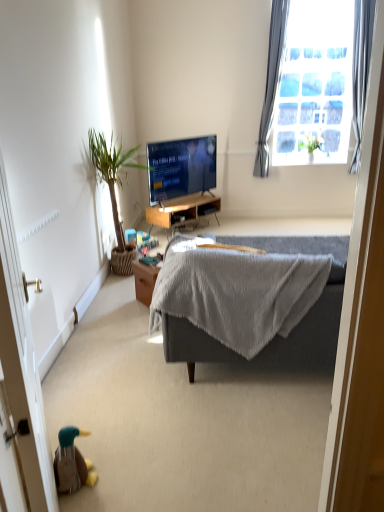
Question: Is satin gray curtain at upper right, which ranks as the first curtain in left-to-right order, closer to the viewer compared to gray fabric curtain at upper right, the 2th curtain from the left?

Choices:
 (A) yes
 (B) no

Answer: (B)

Question: Considering the relative sizes of satin gray curtain at upper right, which ranks as the first curtain in left-to-right order, and gray fabric curtain at upper right, the first curtain when ordered from right to left, in the image provided, is satin gray curtain at upper right, which ranks as the first curtain in left-to-right order, shorter than gray fabric curtain at upper right, the first curtain when ordered from right to left,?

Choices:
 (A) yes
 (B) no

Answer: (B)

Question: Does satin gray curtain at upper right, which ranks as the first curtain in left-to-right order, contain gray fabric curtain at upper right, the first curtain when ordered from right to left?

Choices:
 (A) no
 (B) yes

Answer: (A)

Question: Is the depth of satin gray curtain at upper right, which ranks as the first curtain in left-to-right order, greater than that of gray fabric curtain at upper right, the 2th curtain from the left?

Choices:
 (A) yes
 (B) no

Answer: (A)

Question: Could you tell me if satin gray curtain at upper right, the 2th curtain when ordered from right to left, is facing gray fabric curtain at upper right, the first curtain when ordered from right to left?

Choices:
 (A) no
 (B) yes

Answer: (A)

Question: Does satin gray curtain at upper right, the 2th curtain when ordered from right to left, have a smaller size compared to gray fabric curtain at upper right, the first curtain when ordered from right to left?

Choices:
 (A) no
 (B) yes

Answer: (A)

Question: From a real-world perspective, is green leafy plant at upper right, positioned as the 2th houseplant in left-to-right order, physically above gray fabric curtain at upper right, the first curtain when ordered from right to left?

Choices:
 (A) no
 (B) yes

Answer: (A)

Question: Is green leafy plant at upper right, which is the second houseplant from front to back, wider than gray fabric curtain at upper right, the first curtain when ordered from right to left?

Choices:
 (A) no
 (B) yes

Answer: (B)

Question: Is green leafy plant at upper right, the first houseplant viewed from the back, closer to the viewer compared to gray fabric curtain at upper right, the first curtain when ordered from right to left?

Choices:
 (A) yes
 (B) no

Answer: (B)

Question: Is green leafy plant at upper right, acting as the first houseplant starting from the right, looking in the opposite direction of gray fabric curtain at upper right, the 2th curtain from the left?

Choices:
 (A) yes
 (B) no

Answer: (B)

Question: Can gray fabric curtain at upper right, the 2th curtain from the left, be found inside green leafy plant at upper right, positioned as the 1th houseplant in top-to-bottom order?

Choices:
 (A) no
 (B) yes

Answer: (A)

Question: Is green leafy plant at upper right, positioned as the 1th houseplant in top-to-bottom order, completely or partially outside of gray fabric curtain at upper right, the first curtain when ordered from right to left?

Choices:
 (A) yes
 (B) no

Answer: (A)

Question: Is wooden desk at center further to camera compared to green leafy plant at left, arranged as the first houseplant when ordered from the bottom?

Choices:
 (A) yes
 (B) no

Answer: (A)